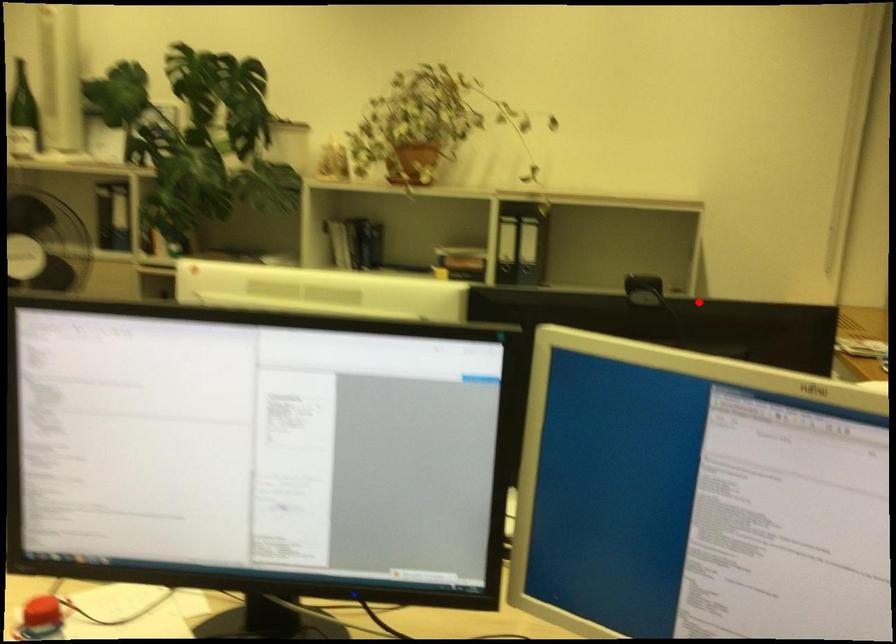
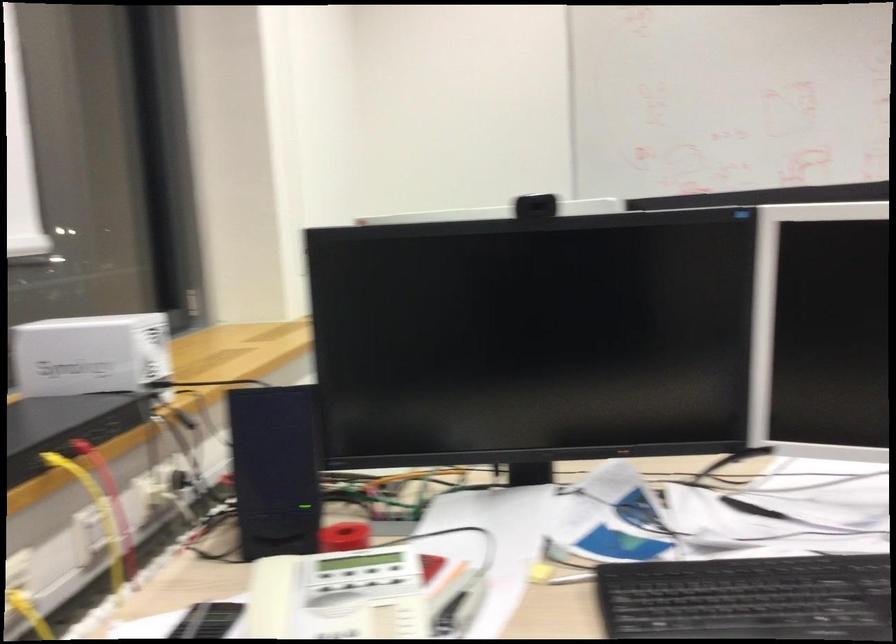
Find the pixel in the second image that matches the highlighted location in the first image.

(536, 205)